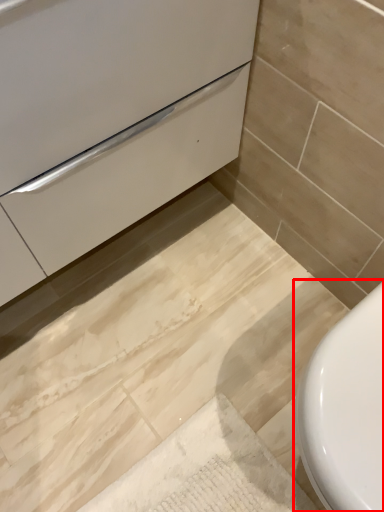
Question: From the image's perspective, where is toilet (annotated by the red box) located relative to drawer?

Choices:
 (A) above
 (B) below

Answer: (B)